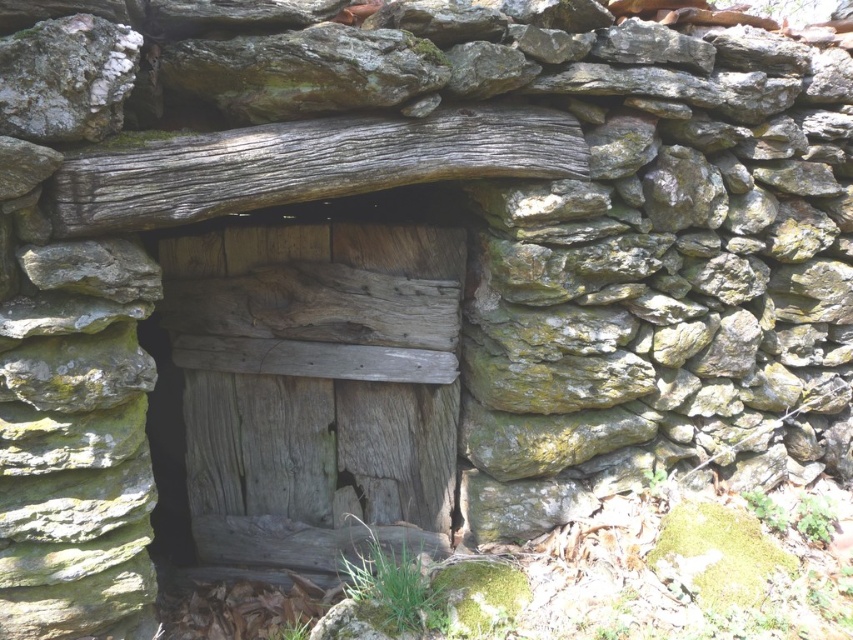
You are standing in front of the rustic stone structure and notice two points marked on the image. The first point is at coordinate point (260, 241) and the second is at point (421, 172). Which point is closer to the wooden door located below the lintel?

Point (421, 172) is closer to the wooden door located below the lintel because it is in front of point (260, 241), which is behind it.

You are a carpenter assessing materials for a project. You have a weathered wood log at center and a speckled gray rock at upper left. Which material would you choose if you need a wider material for your project?

The weathered wood log at center might be wider than the speckled gray rock at upper left, so you should choose the weathered wood log at center for a wider material.

You are a painter who needs to paint the weathered wood door at center. You have a ladder that is 2.5 meters long. Can you reach the top of the door without any additional tools?

The distance between the weathered wood door at center and the wooden beam is 2.62 meters. Since the ladder is only 2.5 meters long, it is not long enough to reach the top of the door.